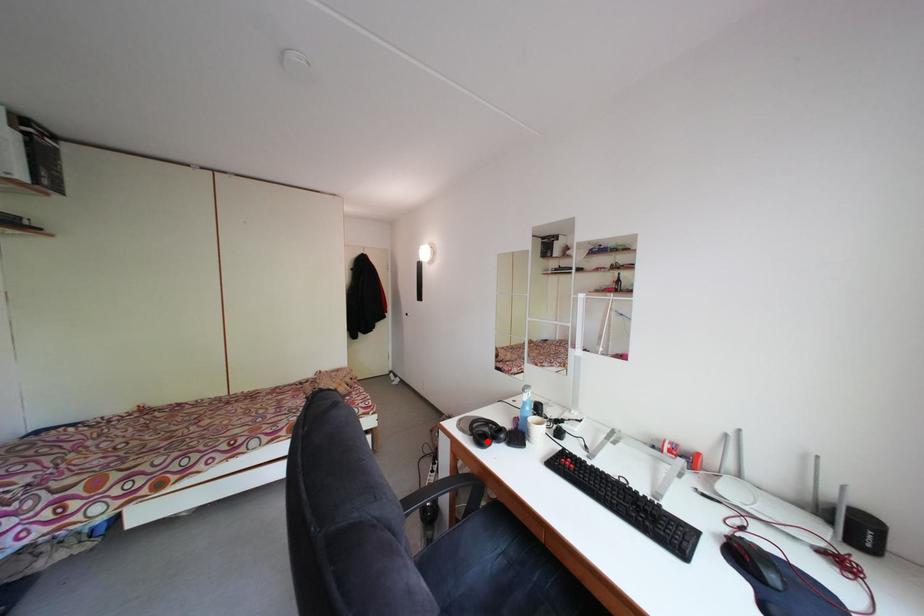
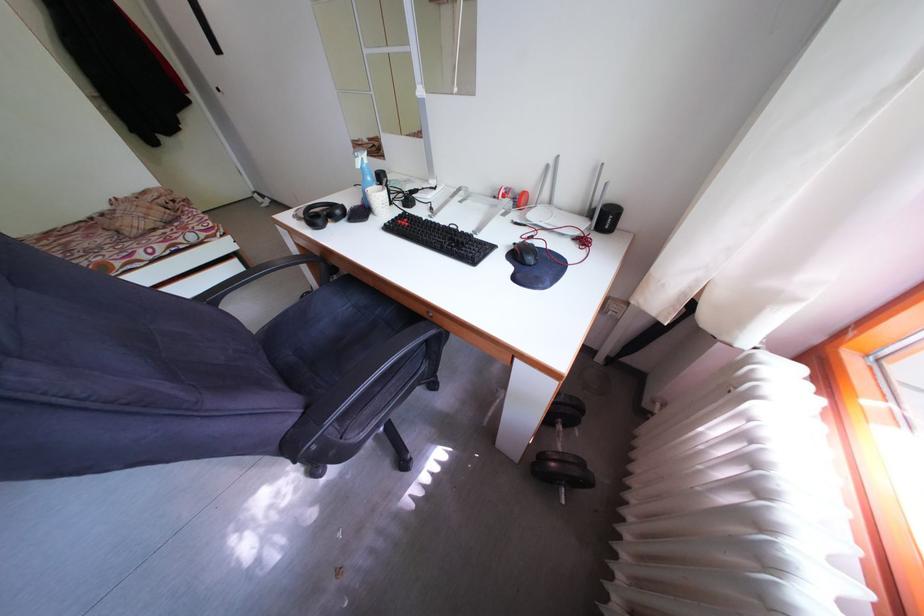
Question: I am providing you with two images of the same scene from different viewpoints. In image1, a red point is highlighted. Considering the same 3D point in image2, which of the following is correct?

Choices:
 (A) It is closer
 (B) It is farther

Answer: (A)